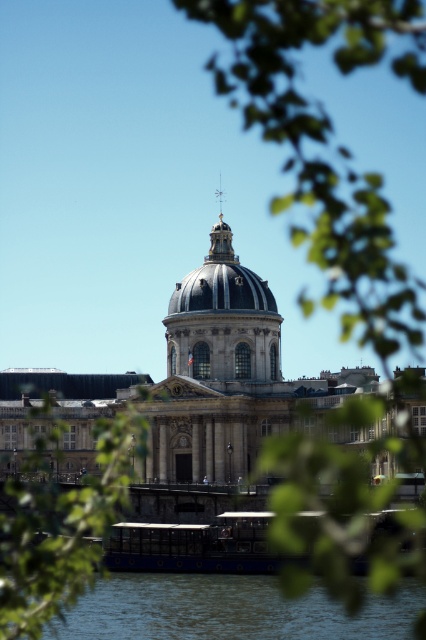
Can you confirm if blue water at lower center is positioned to the right of smooth stone dome at center?

Correct, you'll find blue water at lower center to the right of smooth stone dome at center.

Is point (187, 582) positioned before point (201, 355)?

Yes, point (187, 582) is closer to viewer.

Does point (149, 625) come behind point (172, 300)?

No, (149, 625) is closer to viewer.

Locate an element on the screen. The image size is (426, 640). blue water at lower center is located at coordinates (227, 611).

Between green leafy tree at lower left and smooth stone dome at center, which one has more height?

smooth stone dome at center is taller.

Does green leafy tree at lower left have a greater width compared to smooth stone dome at center?

Yes.

Image resolution: width=426 pixels, height=640 pixels. What do you see at coordinates (60, 524) in the screenshot? I see `green leafy tree at lower left` at bounding box center [60, 524].

You are a GUI agent. You are given a task and a screenshot of the screen. Output one action in this format:
    pyautogui.click(x=<x>, y=<y>)
    Task: Click on the green leafy tree at lower left
    
    Given the screenshot: What is the action you would take?
    pyautogui.click(x=60, y=524)

Is green leafy tree at upper right below smooth stone dome at center?

Incorrect, green leafy tree at upper right is not positioned below smooth stone dome at center.

Is green leafy tree at upper right wider than smooth stone dome at center?

Indeed, green leafy tree at upper right has a greater width compared to smooth stone dome at center.

What do you see at coordinates (330, 160) in the screenshot?
I see `green leafy tree at upper right` at bounding box center [330, 160].

At what (x,y) coordinates should I click in order to perform the action: click on green leafy tree at upper right. Please return your answer as a coordinate pair (x, y). The width and height of the screenshot is (426, 640). Looking at the image, I should click on (330, 160).